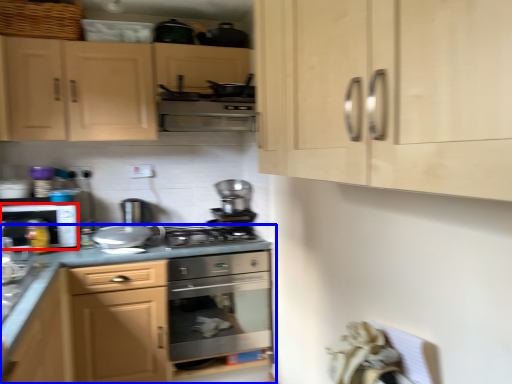
Question: Which object is further to the camera taking this photo, kitchen appliance (highlighted by a red box) or cabinetry (highlighted by a blue box)?

Choices:
 (A) kitchen appliance
 (B) cabinetry

Answer: (A)